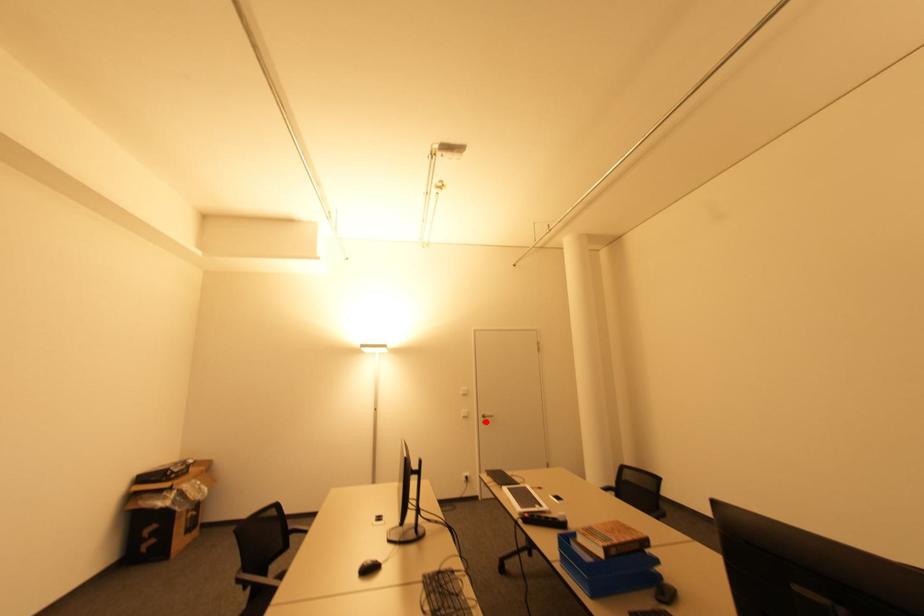
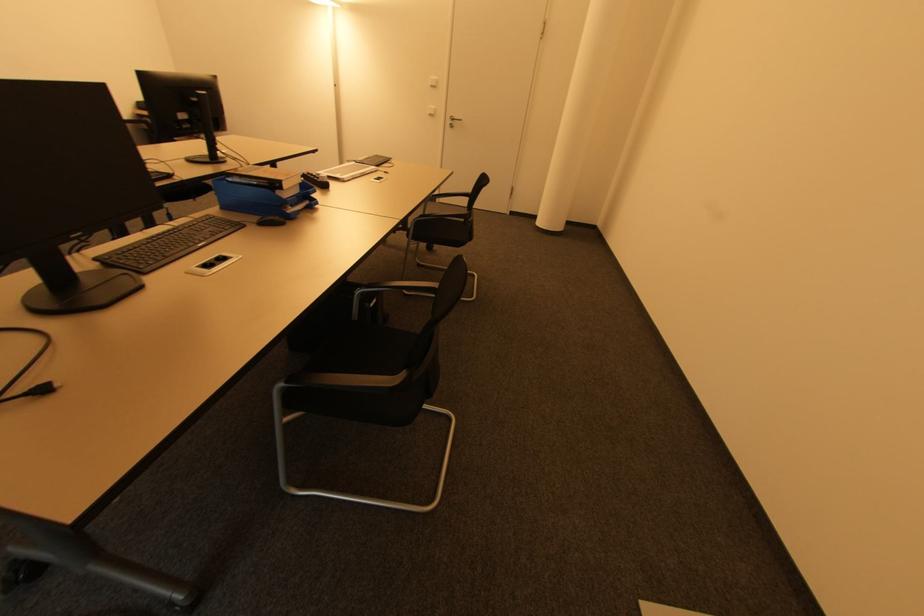
Question: I am providing you with two images of the same scene from different viewpoints. Image1 has a red point marked. In image2, the corresponding 3D location appears at what relative position? Reply with the corresponding letter.

Choices:
 (A) Closer
 (B) Farther

Answer: (A)